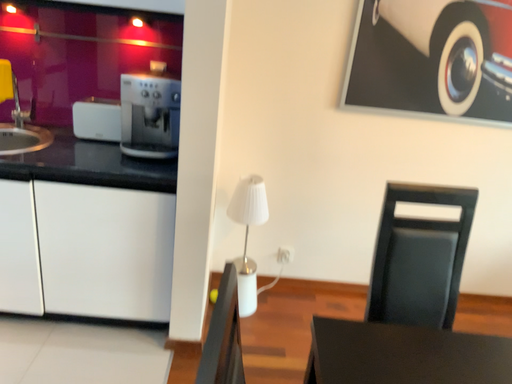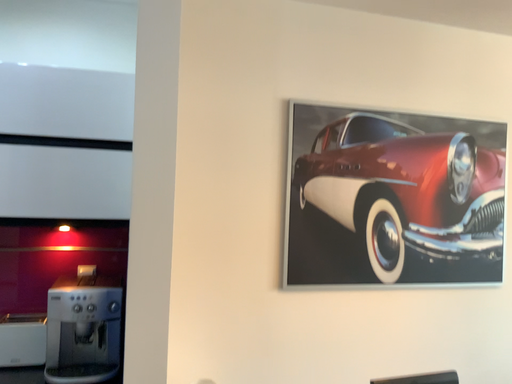
Question: Which way did the camera rotate in the video?

Choices:
 (A) rotated left
 (B) rotated right

Answer: (B)